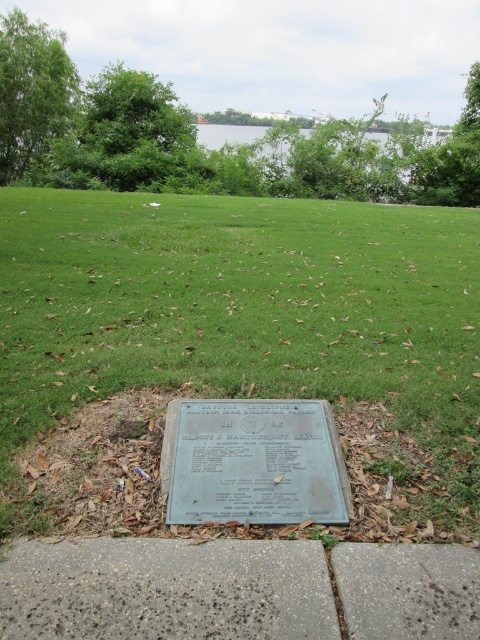
Is point (10, 566) less distant than point (305, 464)?

Yes, it is in front of point (305, 464).

Describe the element at coordinates (167, 589) in the screenshot. I see `gray concrete pavement at lower center` at that location.

At what (x,y) coordinates should I click in order to perform the action: click on gray concrete pavement at lower center. Please return your answer as a coordinate pair (x, y). The width and height of the screenshot is (480, 640). Looking at the image, I should click on (167, 589).

Can you confirm if green grass at center is positioned to the left of green polished stone plaque at center?

Incorrect, green grass at center is not on the left side of green polished stone plaque at center.

Who is lower down, green grass at center or green polished stone plaque at center?

green polished stone plaque at center is lower down.

Find the location of `green grass at center`. green grass at center is located at coordinates (236, 300).

Does green grass at center have a lesser height compared to gray concrete pavement at lower center?

In fact, green grass at center may be taller than gray concrete pavement at lower center.

Is point (120, 212) behind point (44, 630)?

Yes.

Does point (372, 250) come farther from viewer compared to point (471, 596)?

That is True.

Identify the location of green grass at center. (236, 300).